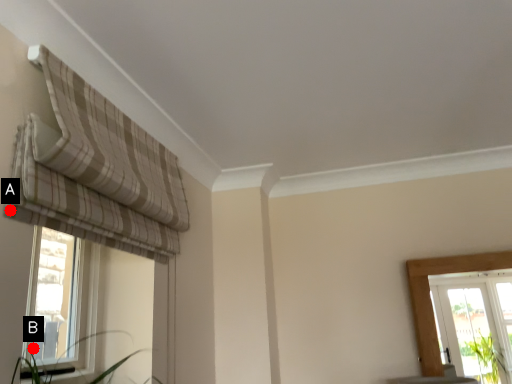
Question: Two points are circled on the image, labeled by A and B beside each circle. Which point is farther from the camera taking this photo?

Choices:
 (A) A is further
 (B) B is further

Answer: (B)